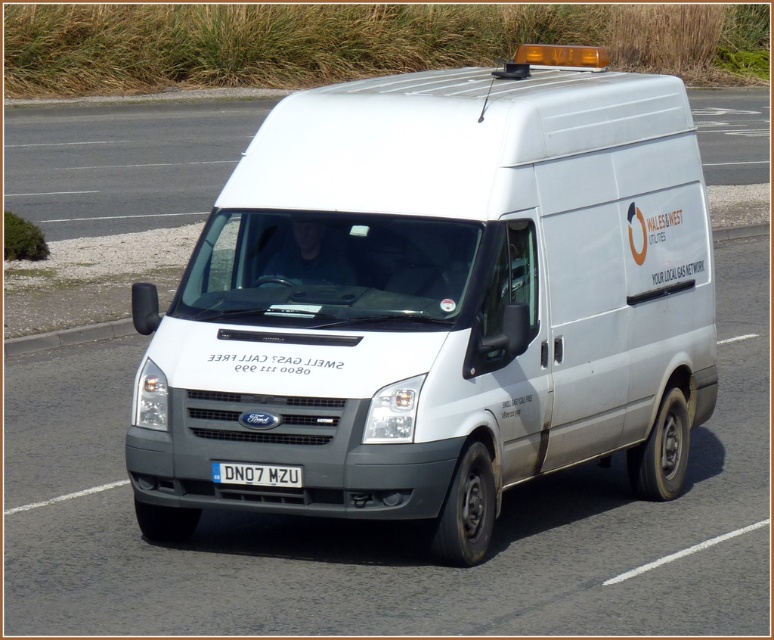
Is white matte van at center wider than white plastic license plate at center?

No, white matte van at center is not wider than white plastic license plate at center.

Does white matte van at center appear on the left side of white plastic license plate at center?

No, white matte van at center is not to the left of white plastic license plate at center.

Describe the element at coordinates (437, 301) in the screenshot. The height and width of the screenshot is (640, 774). I see `white matte van at center` at that location.

Where is `white matte van at center`? white matte van at center is located at coordinates (x=437, y=301).